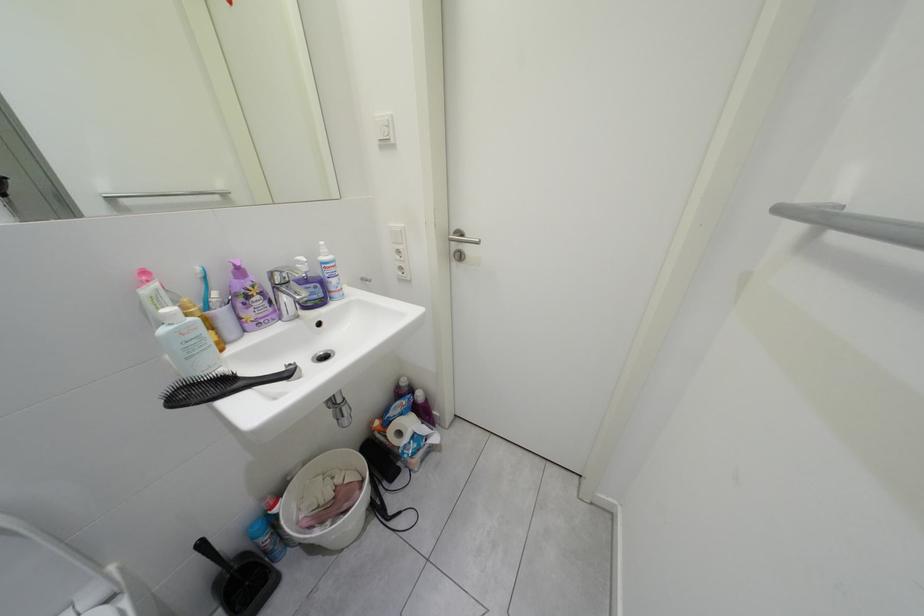
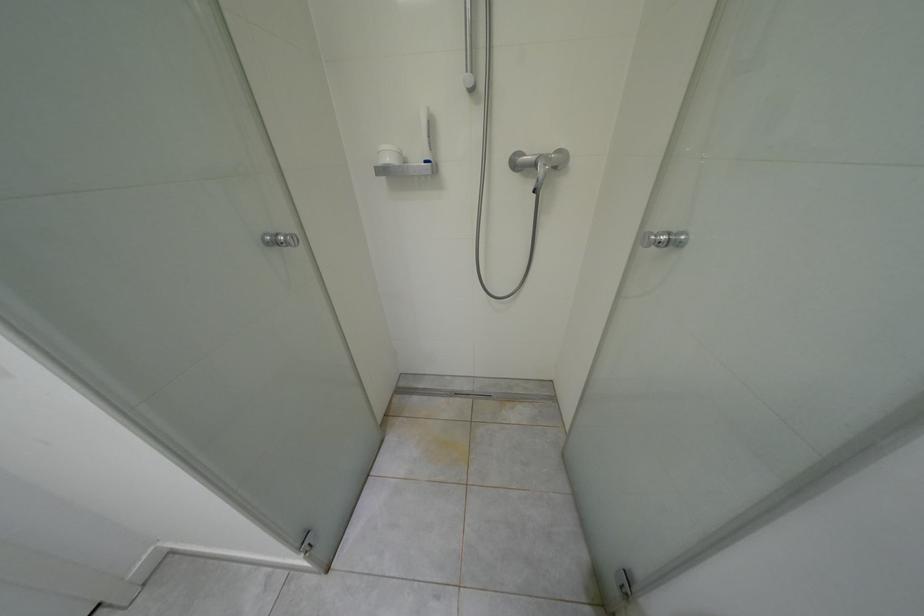
The images are taken continuously from a first-person perspective. In which direction is your viewpoint rotating?

The camera rotated toward right-down.